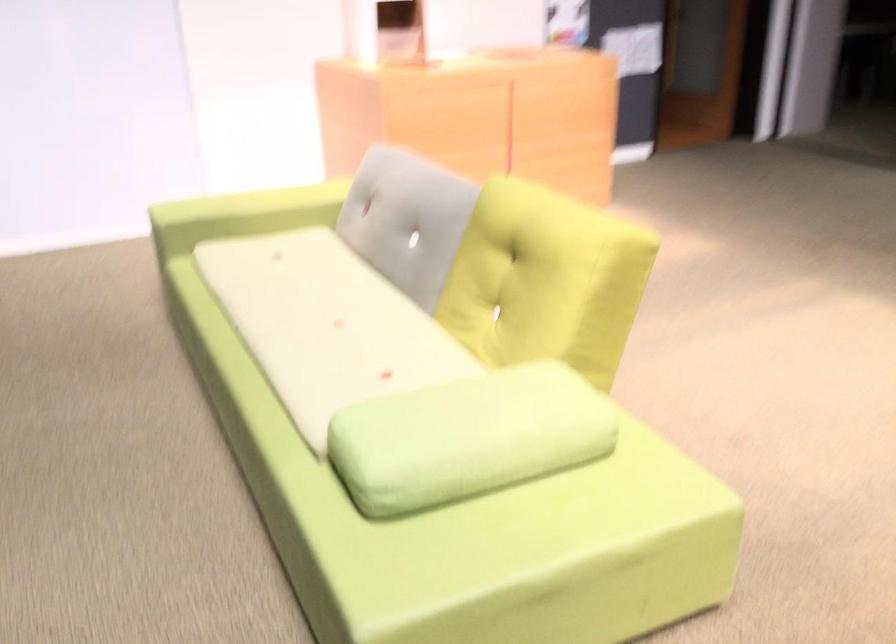
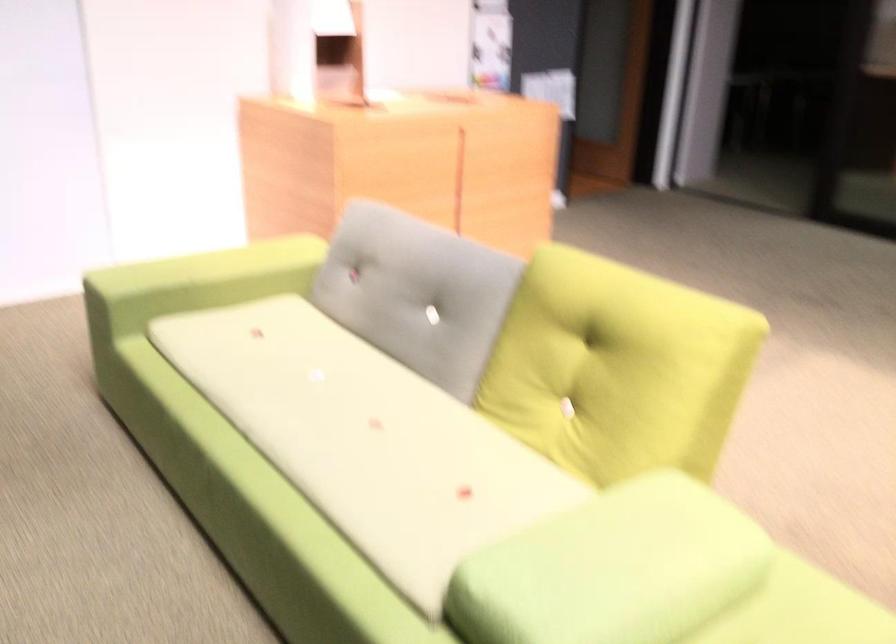
Find the pixel in the second image that matches point 405,220 in the first image.

(417, 292)